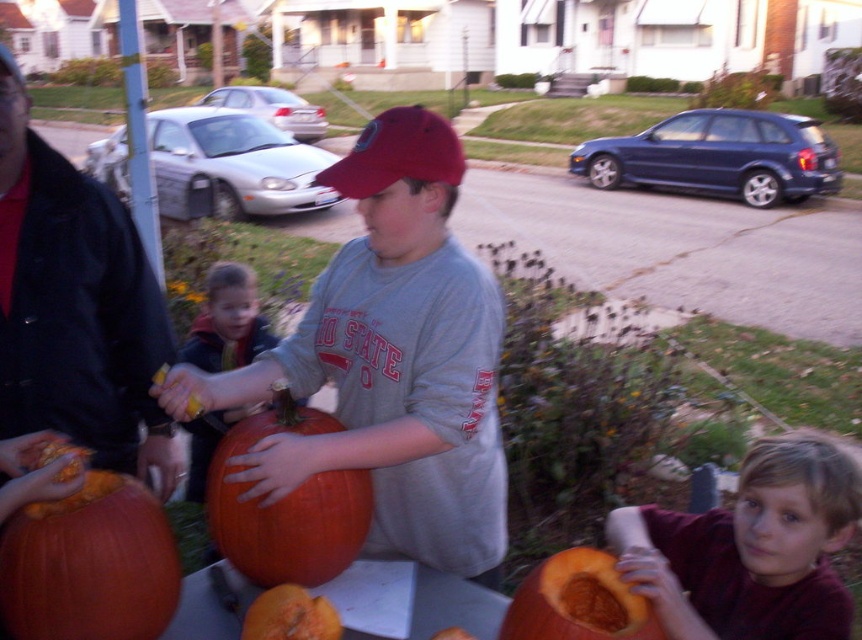
You are a parent supervising the children carving pumpkins. You have two pumpkins available for the kids to use. The orange matte pumpkin at lower left and the orange matte pumpkin at lower center. Which pumpkin should you give to the child who wants to carve a bigger pumpkin?

The orange matte pumpkin at lower left is larger in size compared to the orange matte pumpkin at lower center, so you should give the orange matte pumpkin at lower left to the child who wants to carve a bigger pumpkin.

You are a photographer standing at the edge of the scene. You want to take a photo of both the orange matte pumpkin at lower left and the orange matte pumpkin at lower center without any obstruction. Which pumpkin should you move and in which direction to ensure both are visible?

The orange matte pumpkin at lower center is behind the orange matte pumpkin at lower left. To ensure both are visible, move the orange matte pumpkin at lower center forward so it is no longer obstructed by the orange matte pumpkin at lower left.